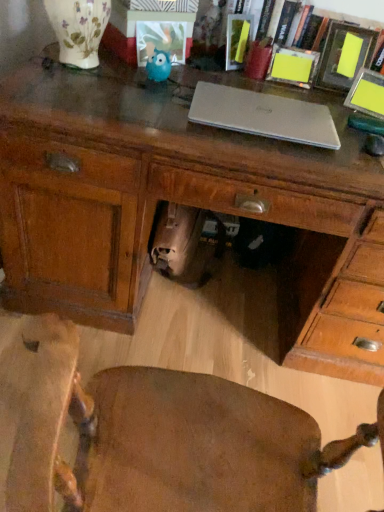
This screenshot has height=512, width=384. I want to click on vacant space situated on the left part of matte plastic picture frame at center, the first picture frame positioned from the left, so coord(109,65).